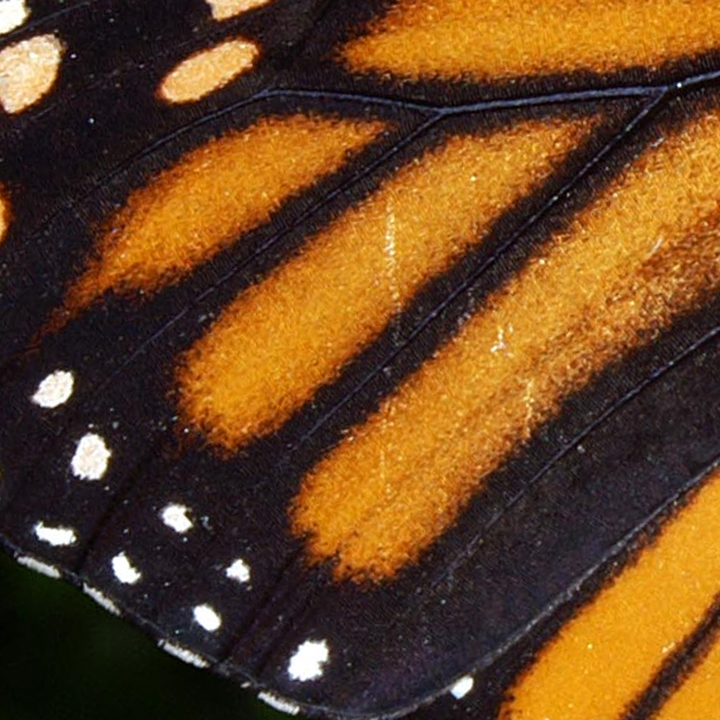
This screenshot has height=720, width=720. Identify the location of corner. (366, 36).